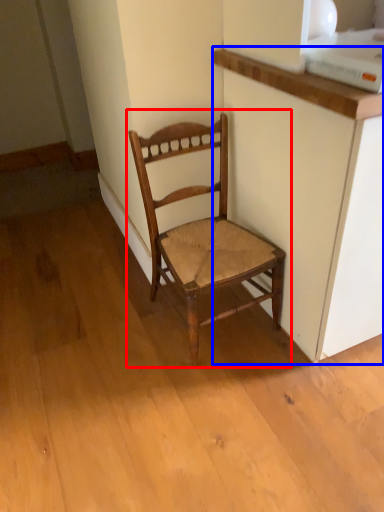
Question: Among these objects, which one is farthest to the camera, chair (highlighted by a red box) or cabinetry (highlighted by a blue box)?

Choices:
 (A) chair
 (B) cabinetry

Answer: (A)